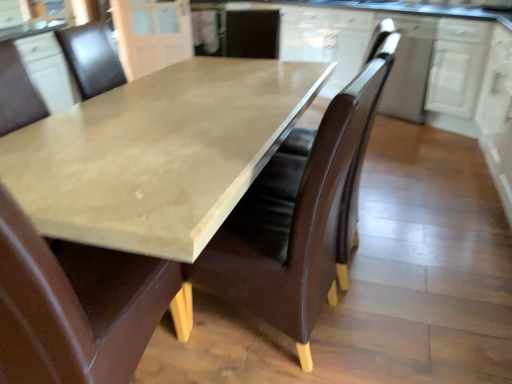
I want to click on vacant area that is situated to the right of matte brown leather chair at center, the 2th chair in the left-to-right sequence, so click(399, 325).